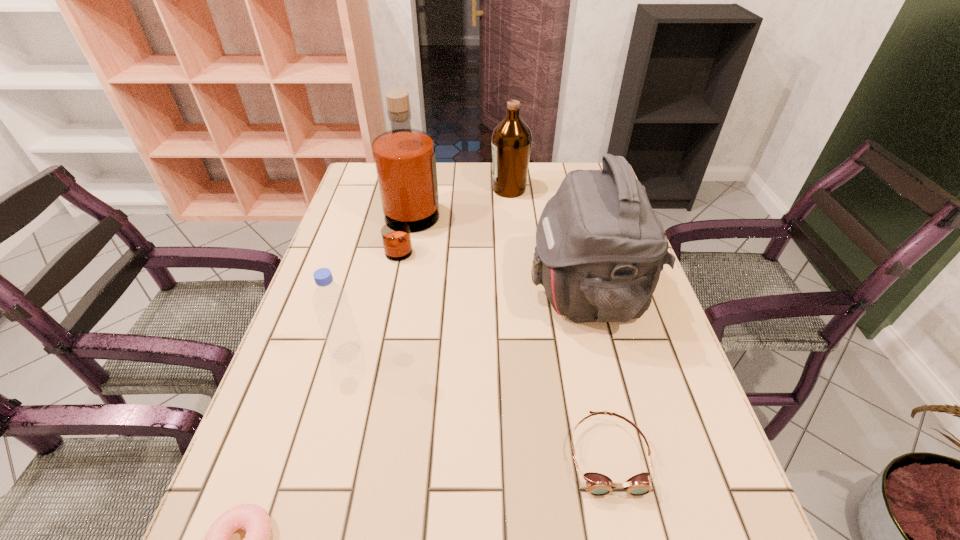
This screenshot has width=960, height=540. I want to click on free space located on the open flap of the shoulder bag, so click(404, 292).

Identify the location of free space located 0.100m on the label of the olive oil. This screenshot has height=540, width=960. (460, 190).

Where is `vacant area located on the label of the olive oil`? The image size is (960, 540). vacant area located on the label of the olive oil is located at coordinates (380, 190).

Locate an element on the screen. The height and width of the screenshot is (540, 960). vacant region located 0.120m on the label of the olive oil is located at coordinates (454, 190).

Find the location of a particular element. The width and height of the screenshot is (960, 540). free spot located on the back of the bottle is located at coordinates (370, 271).

Find the location of `object located at the far edge`. object located at the far edge is located at coordinates (511, 140).

Where is `liquor at the left edge`? Image resolution: width=960 pixels, height=540 pixels. liquor at the left edge is located at coordinates (405, 162).

Find the location of `bottle located at the left edge`. bottle located at the left edge is located at coordinates (330, 301).

At what (x,y) coordinates should I click in order to perform the action: click on shoulder bag present at the right edge. Please return your answer as a coordinate pair (x, y). The image size is (960, 540). Looking at the image, I should click on (600, 248).

In order to click on goggles that is at the right edge in this screenshot , I will do `click(598, 484)`.